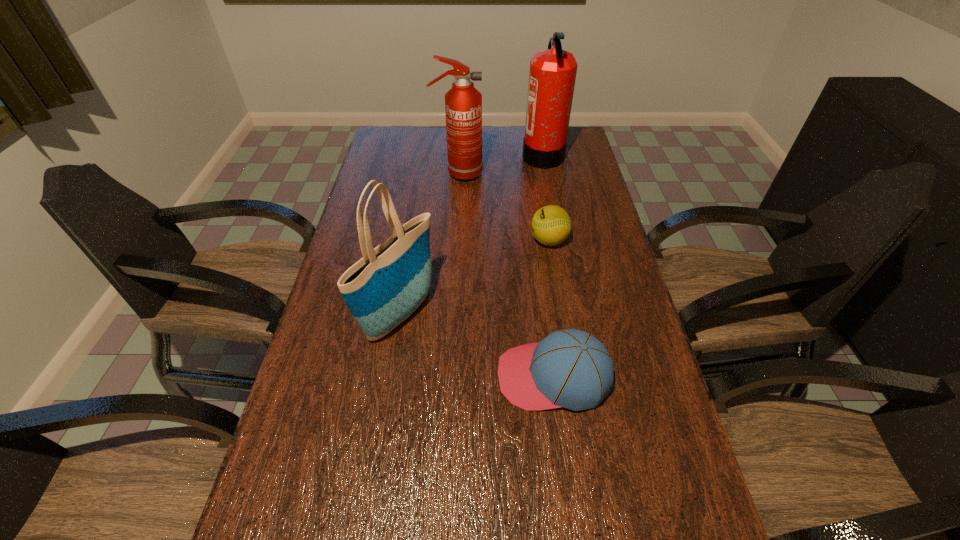
I want to click on softball that is positioned at the right edge, so click(551, 225).

Image resolution: width=960 pixels, height=540 pixels. I want to click on object situated at the far right corner, so click(x=552, y=75).

The height and width of the screenshot is (540, 960). In order to click on vacant region at the far edge of the desktop in this screenshot , I will do `click(519, 128)`.

Locate an element on the screen. The image size is (960, 540). free space at the left edge of the desktop is located at coordinates coord(380,161).

Locate an element on the screen. The height and width of the screenshot is (540, 960). vacant space at the right edge of the desktop is located at coordinates (570, 177).

Locate an element on the screen. vacant space at the far left corner is located at coordinates (412, 132).

Find the location of a particular element. free spot between the tote bag and the right fire extinguisher is located at coordinates (471, 234).

What are the coordinates of `free area in between the right fire extinguisher and the softball` in the screenshot? It's located at (546, 198).

Identify the location of vacant region between the baseball cap and the third farthest object. (551, 308).

In order to click on free space between the right fire extinguisher and the left fire extinguisher in this screenshot , I will do `click(500, 165)`.